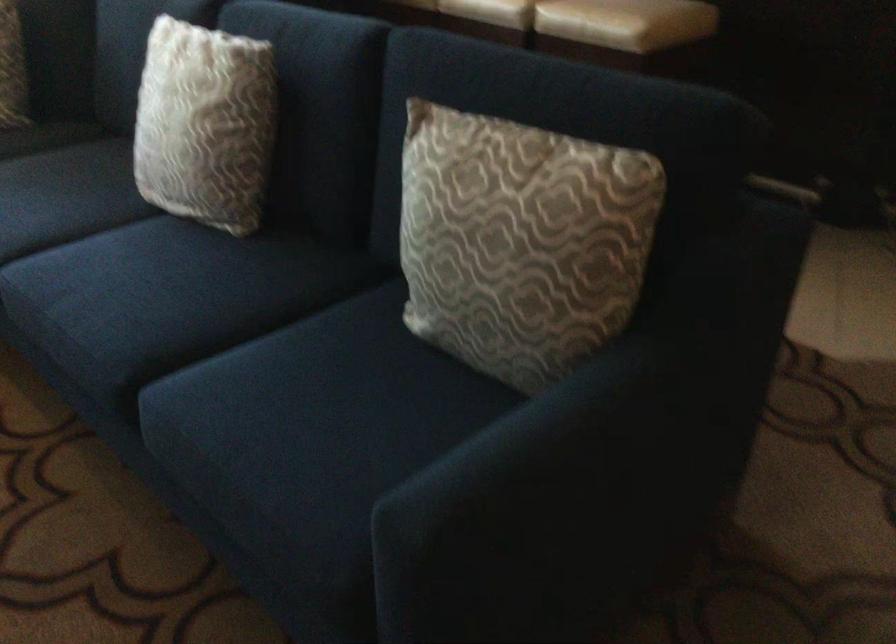
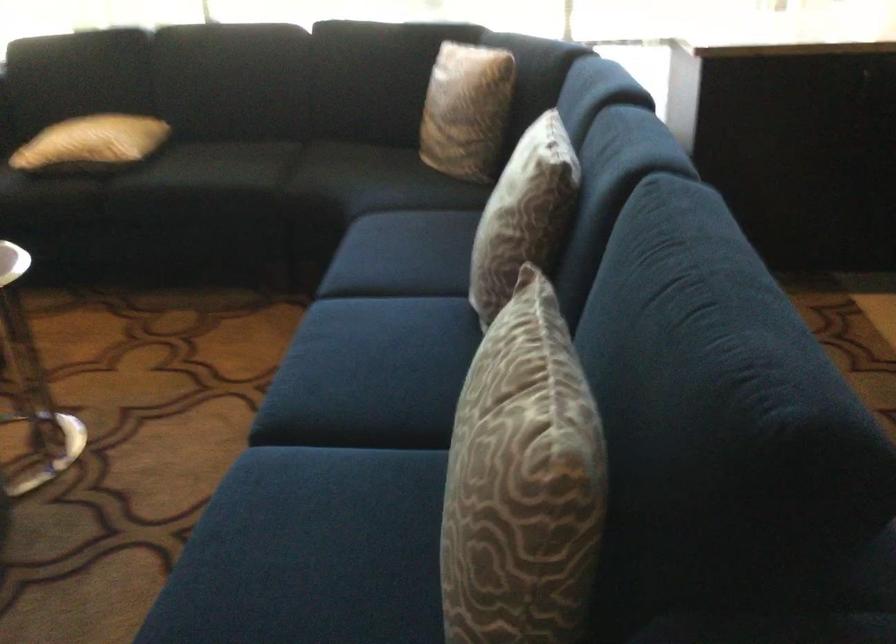
Question: Based on the continuous images, in which direction is the camera rotating? Reply with the corresponding letter.

Choices:
 (A) Left
 (B) Right
 (C) Up
 (D) Down

Answer: (A)